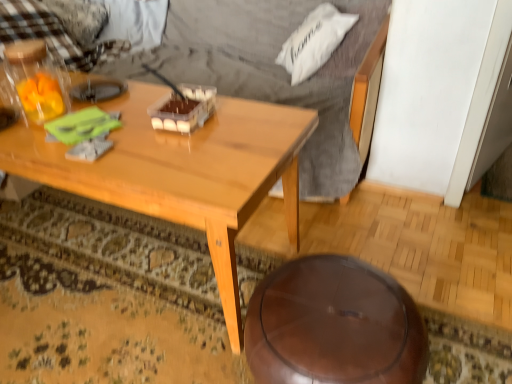
Where is `blank space to the left of translucent plastic container at center`? This screenshot has width=512, height=384. blank space to the left of translucent plastic container at center is located at coordinates (136, 115).